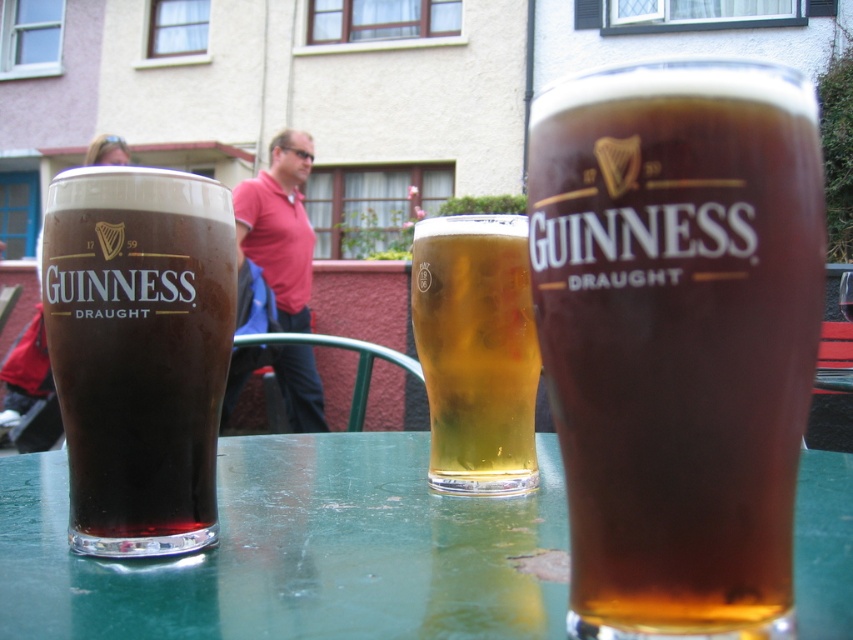
You are a waiter at the pub and need to place a new drink order on the table. The customer wants the drink to be placed to the left of the pink fabric shirt at center. Where should you place the new drink order in relation to the dark brown glass at left?

The dark brown glass at left is positioned on the right side of the pink fabric shirt at center. Therefore, to place the new drink order to the left of the pink fabric shirt at center, you should place it to the left of the dark brown glass at left.

You are standing in the outdoor seating area of the pub and want to pick up an item located at point (553, 195) and another item at point (239, 520). Which item should you reach for first if you want to grab the one closer to you?

You should reach for the item at point (553, 195) first because it is closer to you than the item at point (239, 520).